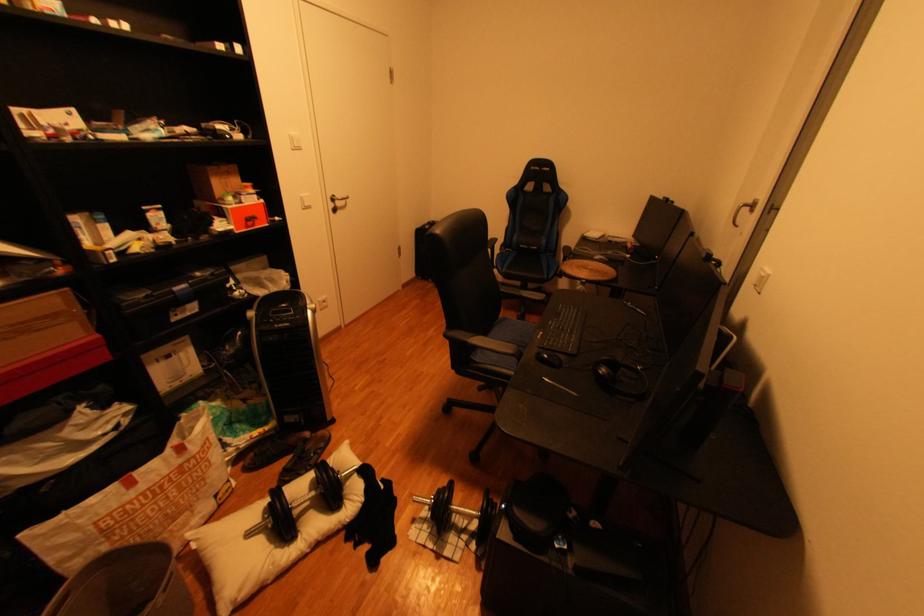
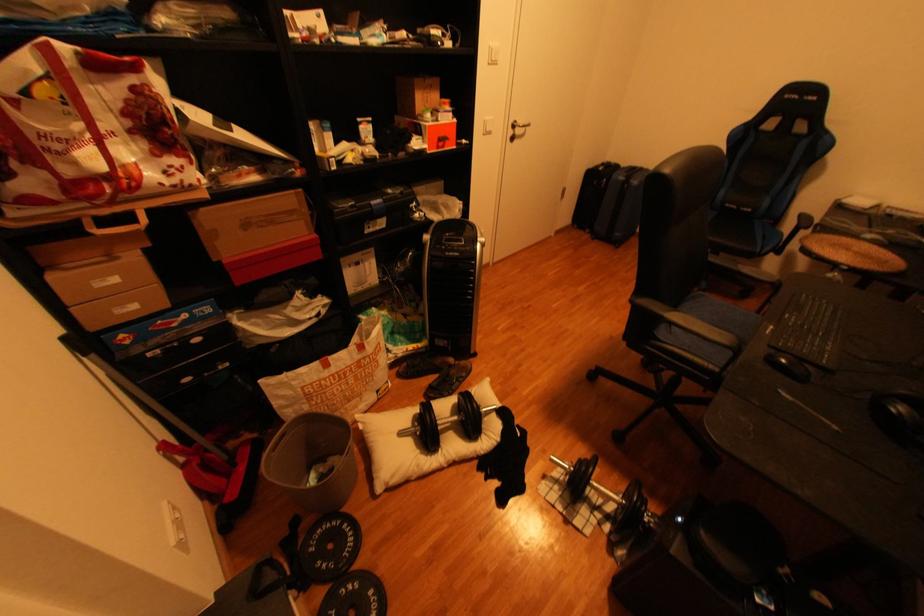
Which direction would the cameraman need to move to produce the second image?

The movement direction of the cameraman is left, forward.